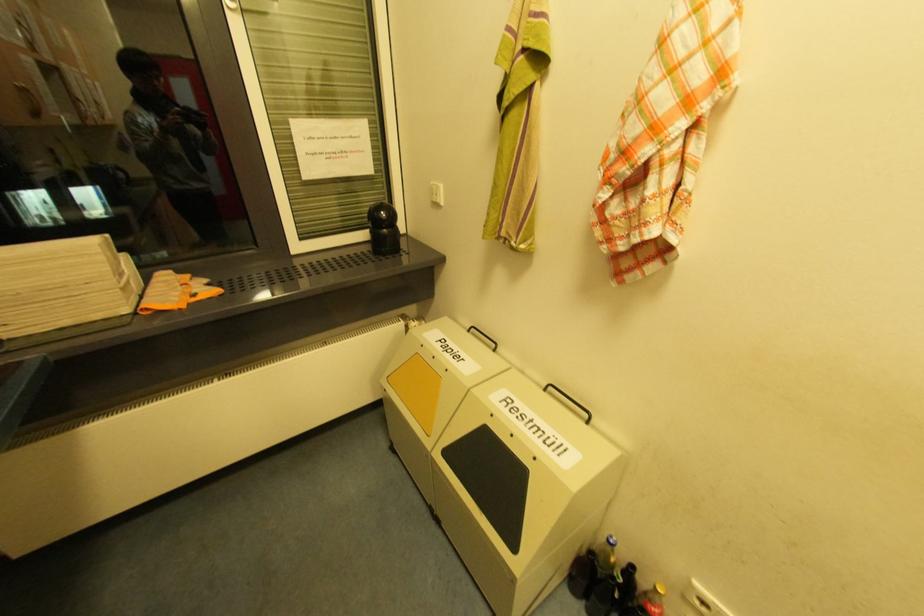
Locate an element on the screen. The height and width of the screenshot is (616, 924). yellow bin flap is located at coordinates (423, 397).